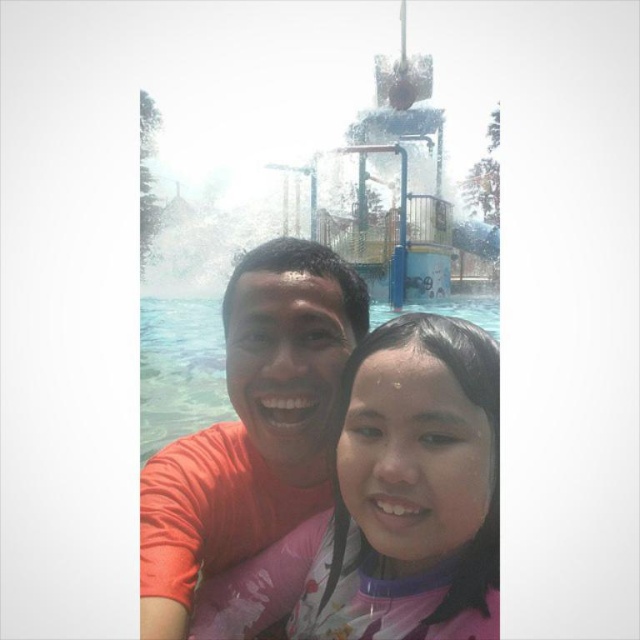
Question: Which object is positioned farthest from the transparent plastic water at center?

Choices:
 (A) pink fabric at center
 (B) orange matte shirt at center

Answer: (A)

Question: Does pink fabric at center have a larger size compared to transparent plastic water at center?

Choices:
 (A) yes
 (B) no

Answer: (A)

Question: Observing the image, what is the correct spatial positioning of pink fabric at center in reference to transparent plastic water at center?

Choices:
 (A) left
 (B) right

Answer: (B)

Question: Which of the following is the farthest from the observer?

Choices:
 (A) transparent plastic water at center
 (B) pink fabric at center

Answer: (A)

Question: Which of the following is the closest to the observer?

Choices:
 (A) (394, 337)
 (B) (193, 326)

Answer: (A)

Question: Can you confirm if orange matte shirt at center is positioned to the left of transparent plastic water at center?

Choices:
 (A) yes
 (B) no

Answer: (A)